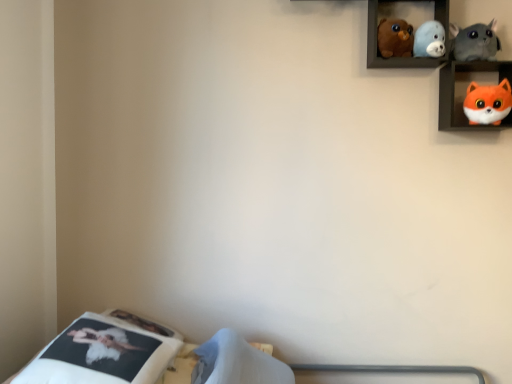
Question: Is orange plush toy at upper right, which is the first shelf from bottom to top, turned away from fluffy gray cat at upper right, marked as the 3th toy in a left-to-right arrangement?

Choices:
 (A) yes
 (B) no

Answer: (B)

Question: From the image's perspective, is orange plush toy at upper right, which is the second shelf from left to right, above fluffy gray cat at upper right, positioned as the second toy in right-to-left order?

Choices:
 (A) no
 (B) yes

Answer: (A)

Question: Does orange plush toy at upper right, which is the second shelf from left to right, have a greater height compared to fluffy gray cat at upper right, positioned as the second toy in right-to-left order?

Choices:
 (A) yes
 (B) no

Answer: (A)

Question: Could fluffy gray cat at upper right, positioned as the second toy in right-to-left order, be considered to be inside orange plush toy at upper right, which is the first shelf from bottom to top?

Choices:
 (A) no
 (B) yes

Answer: (A)

Question: Can you confirm if orange plush toy at upper right, the 1th shelf in the right-to-left sequence, is wider than fluffy gray cat at upper right, positioned as the second toy in right-to-left order?

Choices:
 (A) yes
 (B) no

Answer: (A)

Question: In terms of size, does fluffy gray cat at upper right, positioned as the second toy in right-to-left order, appear bigger or smaller than soft plush toys at upper center, which appears as the first shelf when viewed from the top?

Choices:
 (A) big
 (B) small

Answer: (B)

Question: In the image, is fluffy gray cat at upper right, positioned as the second toy in right-to-left order, positioned in front of or behind soft plush toys at upper center, the second shelf when ordered from bottom to top?

Choices:
 (A) front
 (B) behind

Answer: (A)

Question: From the image's perspective, relative to soft plush toys at upper center, placed as the second shelf when sorted from right to left, is fluffy gray cat at upper right, positioned as the second toy in right-to-left order, above or below?

Choices:
 (A) above
 (B) below

Answer: (B)

Question: Would you say fluffy gray cat at upper right, marked as the 3th toy in a left-to-right arrangement, is inside or outside soft plush toys at upper center, marked as the first shelf in a left-to-right arrangement?

Choices:
 (A) outside
 (B) inside

Answer: (A)

Question: Considering the positions of fluffy gray cat at upper right, marked as the 3th toy in a left-to-right arrangement, and brown plush toy at upper center, which is counted as the first toy, starting from the left, in the image, is fluffy gray cat at upper right, marked as the 3th toy in a left-to-right arrangement, bigger or smaller than brown plush toy at upper center, which is counted as the first toy, starting from the left,?

Choices:
 (A) small
 (B) big

Answer: (B)

Question: In the image, is fluffy gray cat at upper right, marked as the 3th toy in a left-to-right arrangement, positioned in front of or behind brown plush toy at upper center, which is counted as the first toy, starting from the left?

Choices:
 (A) behind
 (B) front

Answer: (B)

Question: From their relative heights in the image, would you say fluffy gray cat at upper right, positioned as the second toy in right-to-left order, is taller or shorter than brown plush toy at upper center, which is the 4th toy in right-to-left order?

Choices:
 (A) tall
 (B) short

Answer: (A)

Question: In the image, is fluffy gray cat at upper right, marked as the 3th toy in a left-to-right arrangement, on the left side or the right side of brown plush toy at upper center, which is the 4th toy in right-to-left order?

Choices:
 (A) left
 (B) right

Answer: (B)

Question: From the image's perspective, is brown plush toy at upper center, which is counted as the first toy, starting from the left, positioned above or below fluffy orange plush at upper right, which is counted as the first toy, starting from the right?

Choices:
 (A) above
 (B) below

Answer: (A)

Question: Looking at their shapes, would you say brown plush toy at upper center, which is counted as the first toy, starting from the left, is wider or thinner than fluffy orange plush at upper right, which is counted as the first toy, starting from the right?

Choices:
 (A) wide
 (B) thin

Answer: (A)